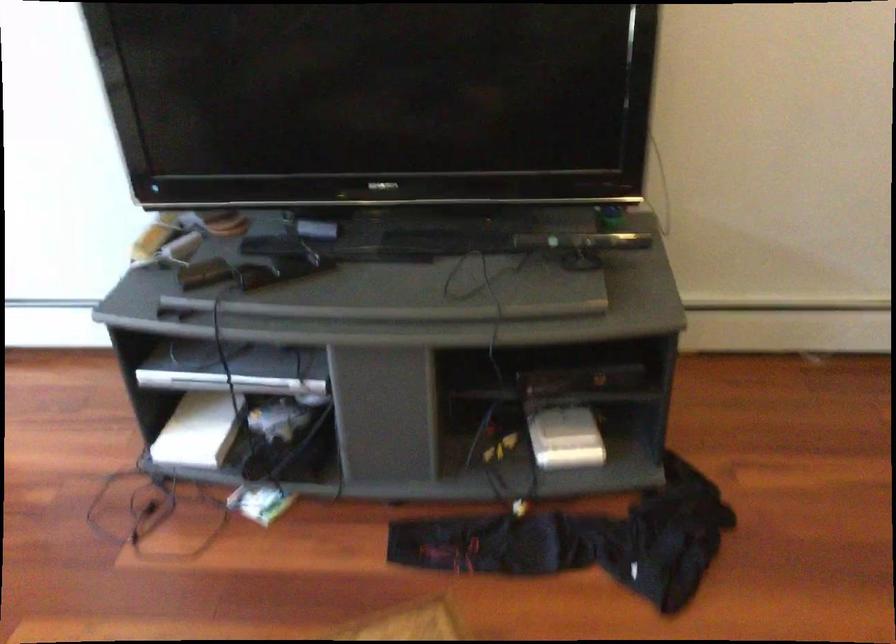
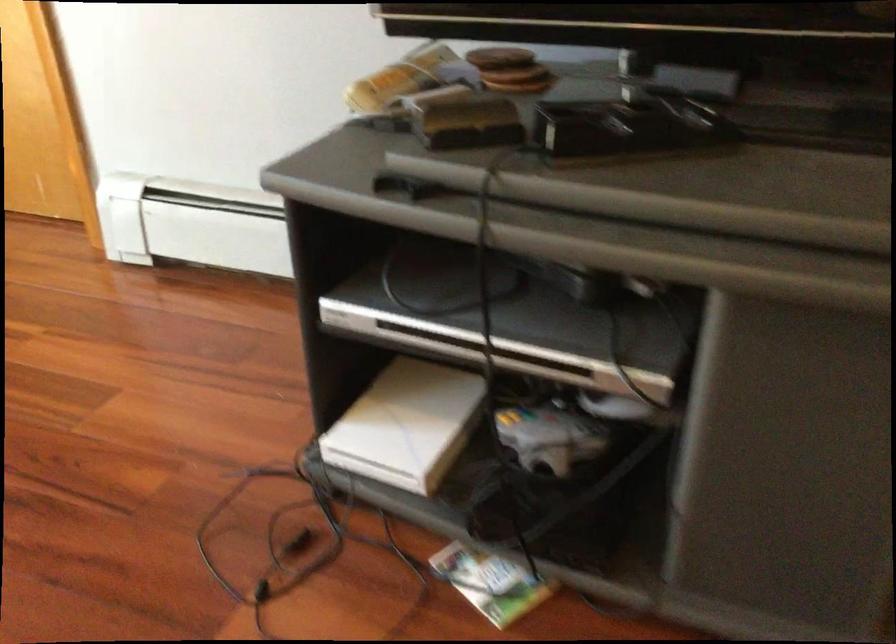
Question: In a continuous first-person perspective shot, in which direction is the camera moving?

Choices:
 (A) Left
 (B) Right
 (C) Forward
 (D) Backward

Answer: (C)